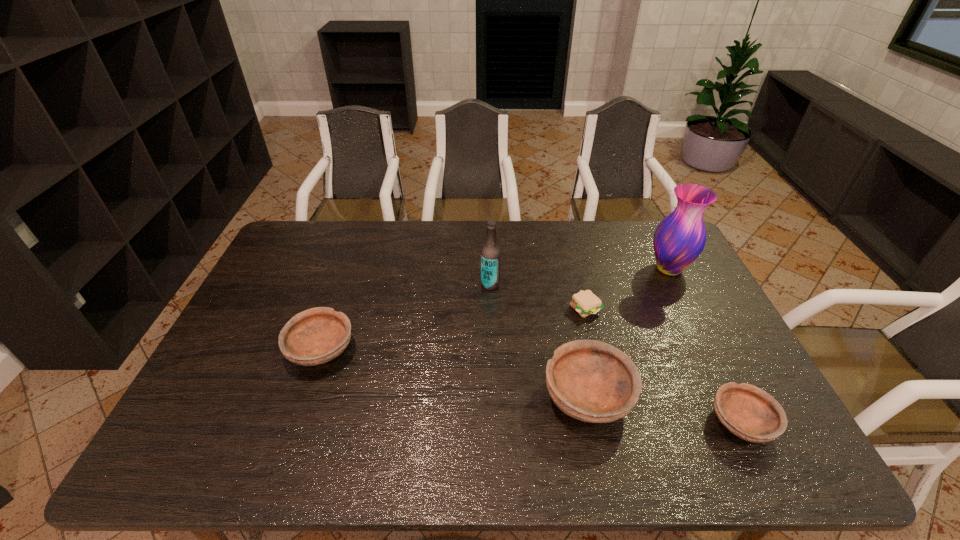
Identify the location of the leftmost object. (315, 336).

Locate an element on the screen. This screenshot has width=960, height=540. the leftmost bowl is located at coordinates (315, 336).

Where is `the tallest bowl`? the tallest bowl is located at coordinates (592, 381).

What are the coordinates of `the second bowl from left to right` in the screenshot? It's located at (592, 381).

Find the location of `the rightmost bowl`. the rightmost bowl is located at coordinates point(750,413).

You are a GUI agent. You are given a task and a screenshot of the screen. Output one action in this format:
    pyautogui.click(x=<x>, y=<y>)
    Task: Click on the shortest bowl
    The width and height of the screenshot is (960, 540).
    Given the screenshot: What is the action you would take?
    pyautogui.click(x=750, y=413)

At what (x,y) coordinates should I click in order to perform the action: click on the shortest object. Please return your answer as a coordinate pair (x, y). The height and width of the screenshot is (540, 960). Looking at the image, I should click on (585, 302).

Where is `the fourth nearest object`? Image resolution: width=960 pixels, height=540 pixels. the fourth nearest object is located at coordinates (585, 302).

Where is `the fifth object from right to left`? The width and height of the screenshot is (960, 540). the fifth object from right to left is located at coordinates (490, 254).

Identify the location of beer bottle. (490, 254).